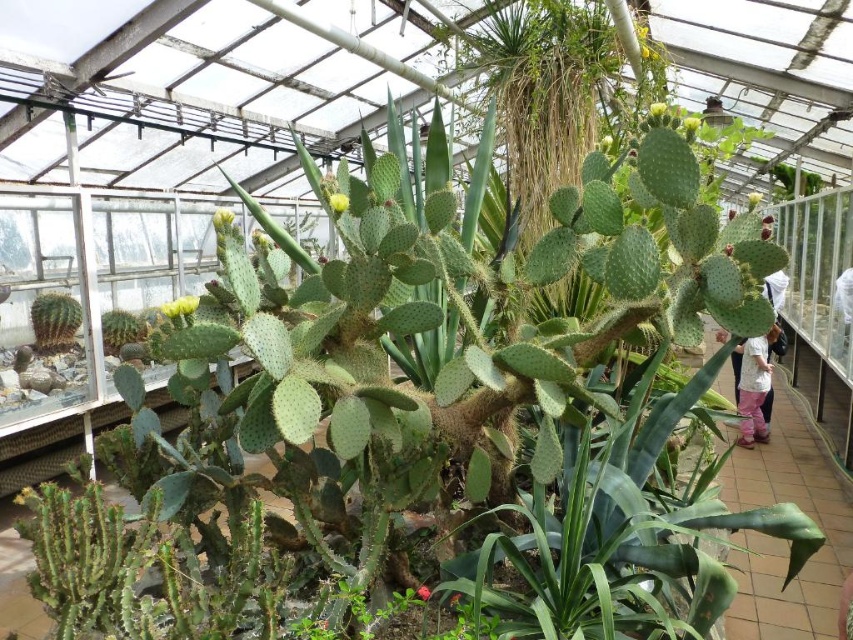
Question: Which point is closer to the camera?

Choices:
 (A) (756, 364)
 (B) (45, 300)

Answer: (B)

Question: Considering the relative positions of white cotton shirt at right and smooth golden cactus at lower left in the image provided, where is white cotton shirt at right located with respect to smooth golden cactus at lower left?

Choices:
 (A) left
 (B) right

Answer: (B)

Question: In this image, where is white cotton shirt at right located relative to smooth golden cactus at lower left?

Choices:
 (A) left
 (B) right

Answer: (B)

Question: Is white cotton shirt at right further to camera compared to smooth golden cactus at lower left?

Choices:
 (A) no
 (B) yes

Answer: (B)